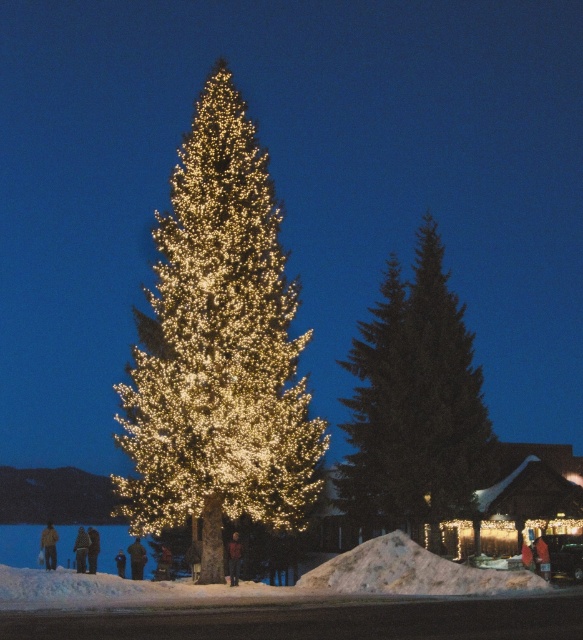
You are a photographer trying to capture the illuminated gold christmas tree at center without the black fabric person at lower left appearing in the shot. Based on their positions, is this possible?

The illuminated gold christmas tree at center is positioned over the black fabric person at lower left, so the photographer cannot avoid capturing the black fabric person at lower left in the shot.